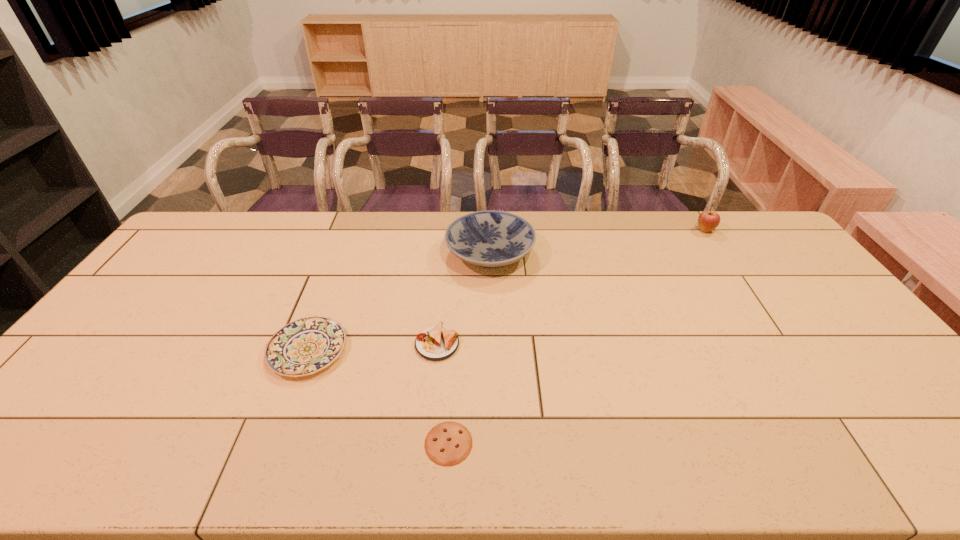
Locate an element on the screen. Image resolution: width=960 pixels, height=540 pixels. free space between the shortest object and the sandwich is located at coordinates (443, 394).

The width and height of the screenshot is (960, 540). Find the location of `free space that is in between the taller plate and the apple`. free space that is in between the taller plate and the apple is located at coordinates (597, 241).

I want to click on empty location between the third shortest object and the left plate, so click(x=372, y=347).

At what (x,y) coordinates should I click in order to perform the action: click on vacant area that lies between the second shortest object and the cookie. Please return your answer as a coordinate pair (x, y). The width and height of the screenshot is (960, 540). Looking at the image, I should click on (378, 396).

This screenshot has height=540, width=960. In order to click on vacant area that lies between the apple and the sandwich in this screenshot , I will do `click(571, 287)`.

Locate an element on the screen. Image resolution: width=960 pixels, height=540 pixels. vacant region between the taller plate and the left plate is located at coordinates (399, 301).

You are a GUI agent. You are given a task and a screenshot of the screen. Output one action in this format:
    pyautogui.click(x=<x>, y=<y>)
    Task: Click on the free space between the third tallest object and the taller plate
    
    Given the screenshot: What is the action you would take?
    pyautogui.click(x=464, y=299)

Where is `free point between the shortest object and the left plate`? free point between the shortest object and the left plate is located at coordinates (378, 396).

Find the location of a particular element. The width and height of the screenshot is (960, 540). unoccupied position between the shortest object and the sandwich is located at coordinates (443, 394).

You are a GUI agent. You are given a task and a screenshot of the screen. Output one action in this format:
    pyautogui.click(x=<x>, y=<y>)
    Task: Click on the vacant area that lies between the farther plate and the apple
    This screenshot has width=960, height=540.
    Given the screenshot: What is the action you would take?
    pyautogui.click(x=597, y=241)